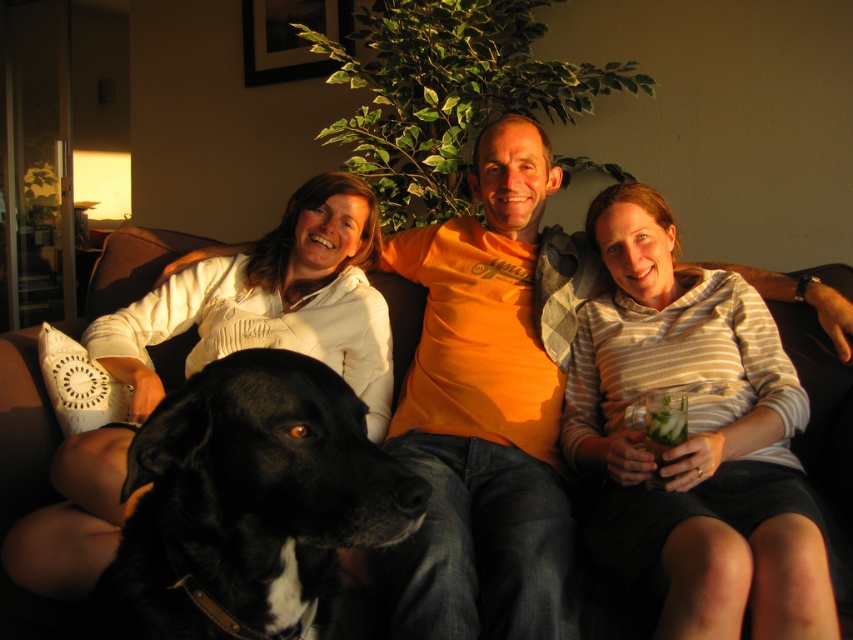
You are a photographer setting up a camera to capture the scene. You want to ensure that both the black leather dog at lower left and the white cotton shirt at center are in focus. Given that your camera can only focus on objects wider than 20 cm, will both objects meet the focus requirement?

The black leather dog at lower left is less than the white cotton shirt at center in width. Since the white cotton shirt at center is wider than 20 cm, it will be in focus. However, the black leather dog at lower left is narrower than the white cotton shirt at center, so it might be too small to meet the 20 cm focus requirement. Therefore, only the white cotton shirt at center will be in focus.

What is located at the coordinates point (248, 502)?

The black leather dog at lower left is located at point (248, 502).